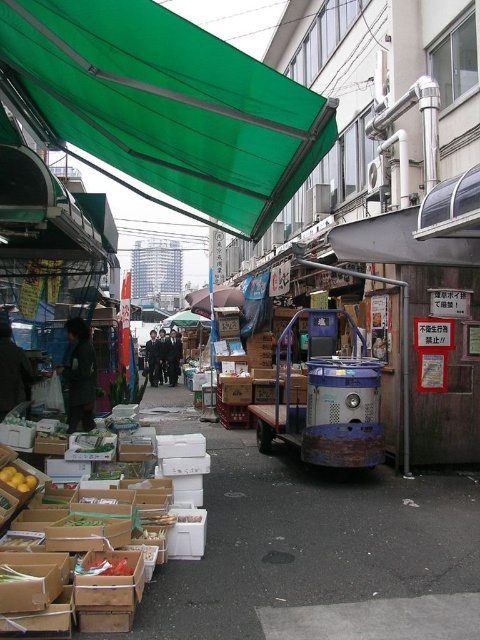
Question: From the image, what is the correct spatial relationship of green fabric canopy at upper center in relation to yellow matte lemons at lower left?

Choices:
 (A) above
 (B) below

Answer: (A)

Question: Does blue metallic cart at center lie behind yellow matte lemons at lower left?

Choices:
 (A) yes
 (B) no

Answer: (A)

Question: Which of the following is the farthest from the observer?

Choices:
 (A) (88, 80)
 (B) (268, 444)
 (C) (29, 477)

Answer: (B)

Question: Does blue metallic cart at center appear under yellow matte lemons at lower left?

Choices:
 (A) yes
 (B) no

Answer: (B)

Question: Which of these objects is positioned farthest from the blue metallic cart at center?

Choices:
 (A) green fabric canopy at upper center
 (B) yellow matte lemons at lower left

Answer: (B)

Question: Among these objects, which one is farthest from the camera?

Choices:
 (A) blue metallic cart at center
 (B) yellow matte lemons at lower left
 (C) green fabric canopy at upper center

Answer: (A)